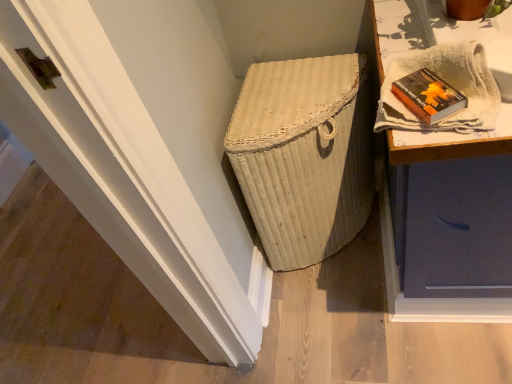
Question: Is white textured cloth at upper right facing towards white wicker basket at center?

Choices:
 (A) no
 (B) yes

Answer: (A)

Question: Can you confirm if white textured cloth at upper right is shorter than white wicker basket at center?

Choices:
 (A) no
 (B) yes

Answer: (B)

Question: From a real-world perspective, is white textured cloth at upper right on top of white wicker basket at center?

Choices:
 (A) no
 (B) yes

Answer: (B)

Question: Considering the relative sizes of white textured cloth at upper right and white wicker basket at center in the image provided, is white textured cloth at upper right thinner than white wicker basket at center?

Choices:
 (A) no
 (B) yes

Answer: (B)

Question: Does white textured cloth at upper right have a smaller size compared to white wicker basket at center?

Choices:
 (A) yes
 (B) no

Answer: (A)

Question: Is white textured cloth at upper right positioned far away from white wicker basket at center?

Choices:
 (A) yes
 (B) no

Answer: (B)

Question: Can you see white wicker basket at center touching hardcover book at upper right?

Choices:
 (A) no
 (B) yes

Answer: (A)

Question: From a real-world perspective, is white wicker basket at center positioned under hardcover book at upper right based on gravity?

Choices:
 (A) no
 (B) yes

Answer: (B)

Question: Does white wicker basket at center lie in front of hardcover book at upper right?

Choices:
 (A) yes
 (B) no

Answer: (B)

Question: Is white wicker basket at center oriented away from hardcover book at upper right?

Choices:
 (A) no
 (B) yes

Answer: (A)

Question: Is white wicker basket at center shorter than hardcover book at upper right?

Choices:
 (A) no
 (B) yes

Answer: (A)

Question: Could you tell me if white wicker basket at center is turned towards hardcover book at upper right?

Choices:
 (A) yes
 (B) no

Answer: (B)

Question: Does hardcover book at upper right lie in front of white wicker basket at center?

Choices:
 (A) no
 (B) yes

Answer: (B)